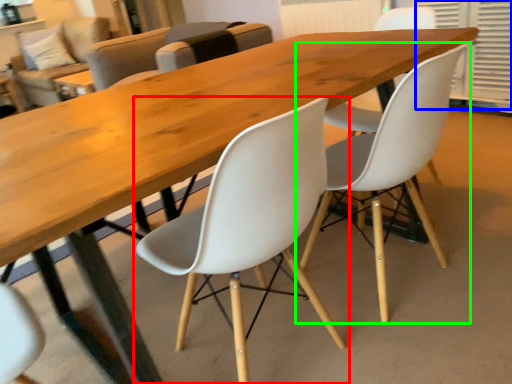
Question: Considering the real-world distances, which object is closest to chair (highlighted by a red box)? shutter (highlighted by a blue box) or chair (highlighted by a green box).

Choices:
 (A) shutter
 (B) chair

Answer: (B)